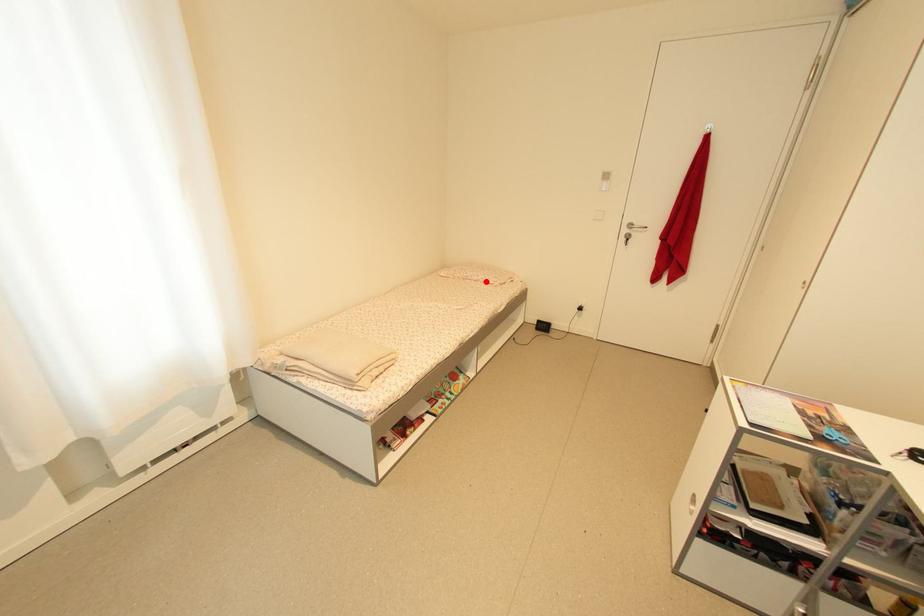
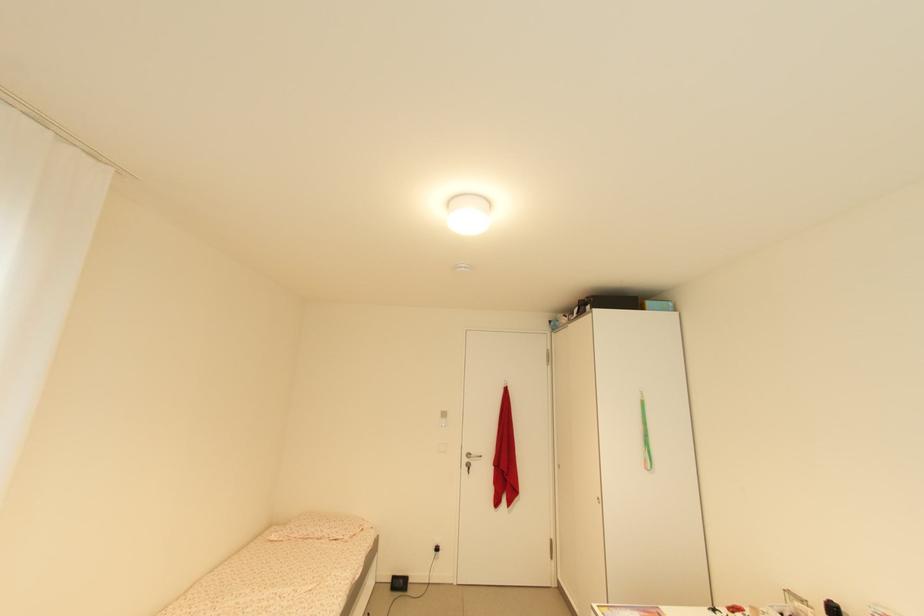
Question: I am providing you with two images of the same scene from different viewpoints. Given a red point in image1, look at the same physical point in image2. Is it:

Choices:
 (A) Closer to the viewpoint
 (B) Farther from the viewpoint

Answer: (B)